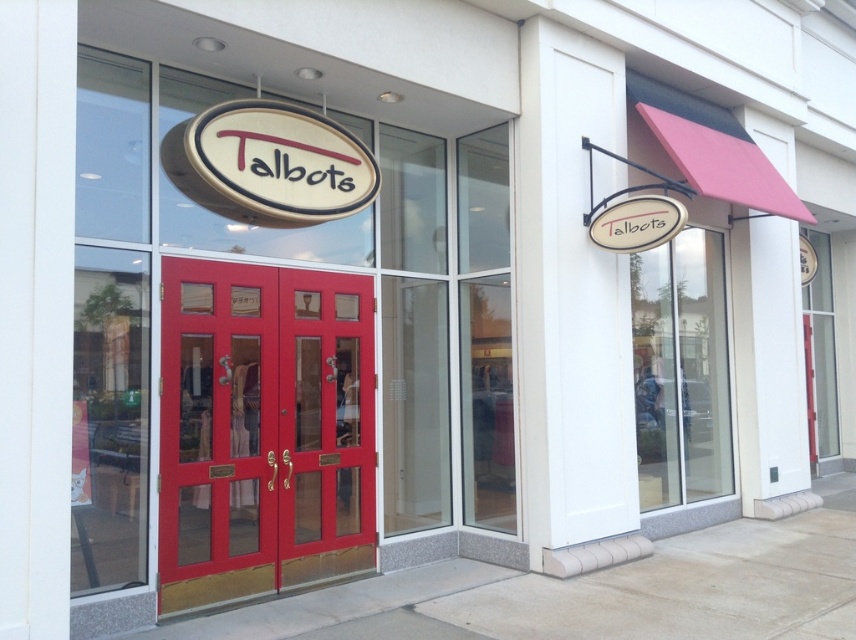
You are a customer approaching the Talbots store entrance. You see two doors, the matte glass door at center and the transparent glass door at center. Which door should you push to enter?

The matte glass door at center is in front of the transparent glass door at center, so you should push the matte glass door at center to enter.

You are a delivery person trying to enter the Talbots store. You see the matte wood door at center and the transparent glass door at center. Which door should you use to enter the store?

The transparent glass door at center is larger and occupies more space than the matte wood door at center, so you should use the transparent glass door at center to enter the store.

You are standing in front of the Talbots store entrance. You want to enter the store but need to locate the entrance doors. Which object is closer to you between the matte glass door at center and the white wood sign at upper right?

The matte glass door at center is closer to the viewer than the white wood sign at upper right, so the entrance doors are the closer object.